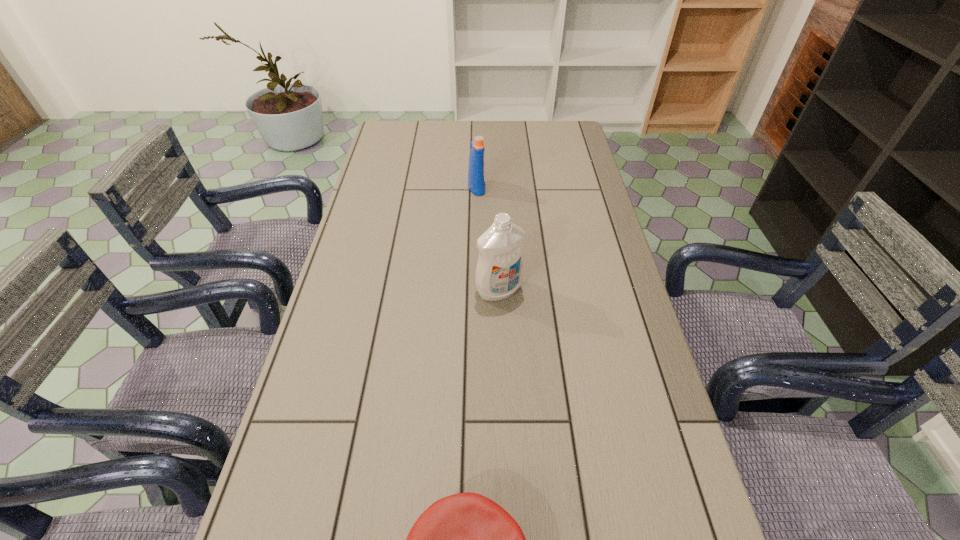
The image size is (960, 540). In order to click on the tallest object in this screenshot , I will do `click(499, 272)`.

I want to click on the taller detergent, so click(499, 272).

Identify the location of the shorter detergent. (476, 169).

At what (x,y) coordinates should I click in order to perform the action: click on the second tallest object. Please return your answer as a coordinate pair (x, y). Looking at the image, I should click on (476, 169).

Locate an element on the screen. This screenshot has height=540, width=960. vacant position located on the back of the nearer detergent is located at coordinates (497, 248).

Where is `vacant space situated on the label of the second shortest object`? This screenshot has width=960, height=540. vacant space situated on the label of the second shortest object is located at coordinates 549,187.

This screenshot has height=540, width=960. I want to click on free space at the far edge, so click(x=423, y=129).

The width and height of the screenshot is (960, 540). Identify the location of blank space at the left edge of the desktop. (384, 246).

Identify the location of free region at the right edge of the desktop. (589, 272).

Locate an element on the screen. This screenshot has height=540, width=960. free region at the far left corner of the desktop is located at coordinates (384, 132).